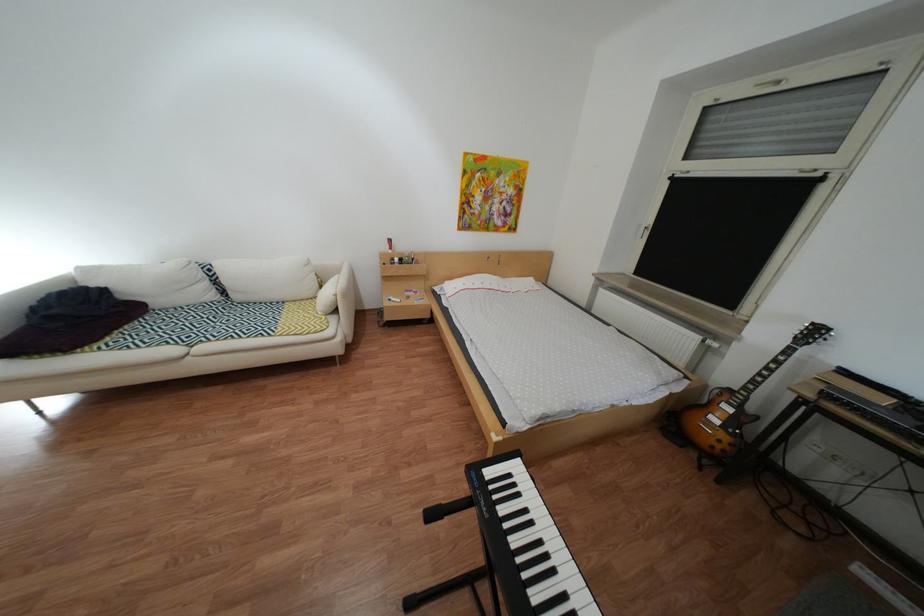
Find where to resting arm the white sofa armrest. Please return your answer as a coordinate pair (x, y).

(346, 301)